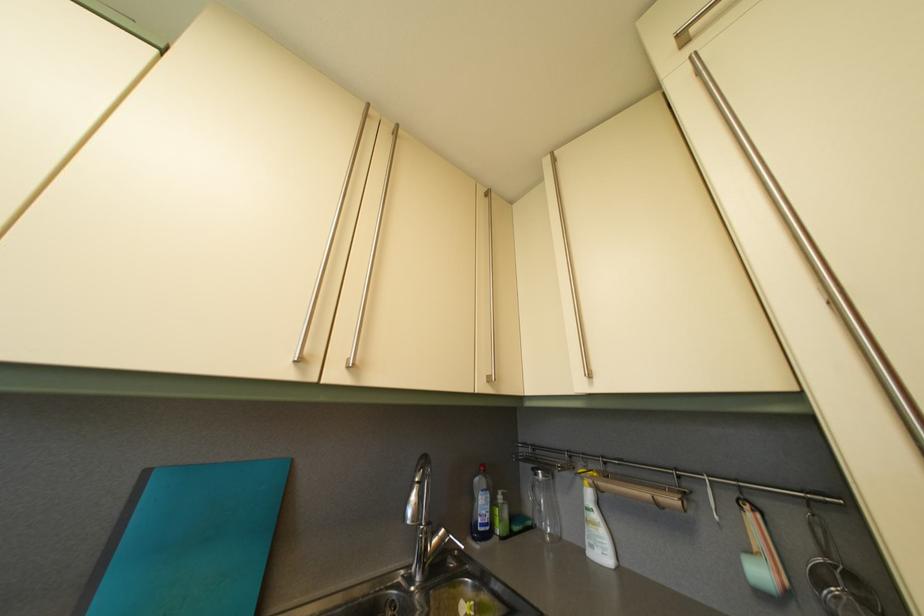
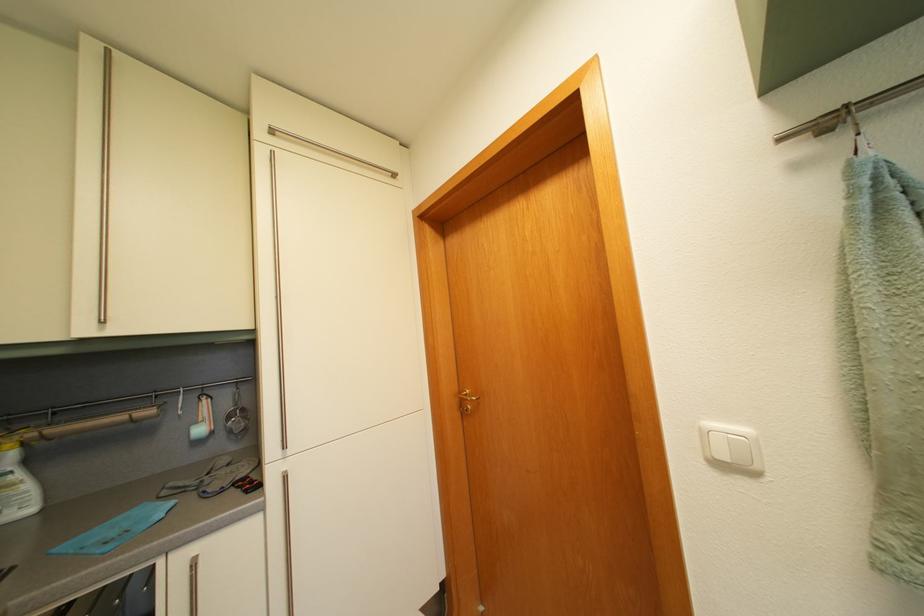
Locate, in the second image, the point that corresponds to point 825,586 in the first image.

(237, 424)